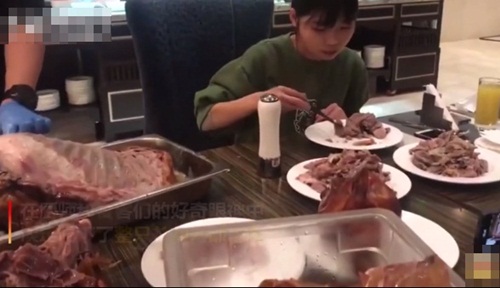
Where is `metal pan`? The image size is (500, 288). metal pan is located at coordinates (200, 185).